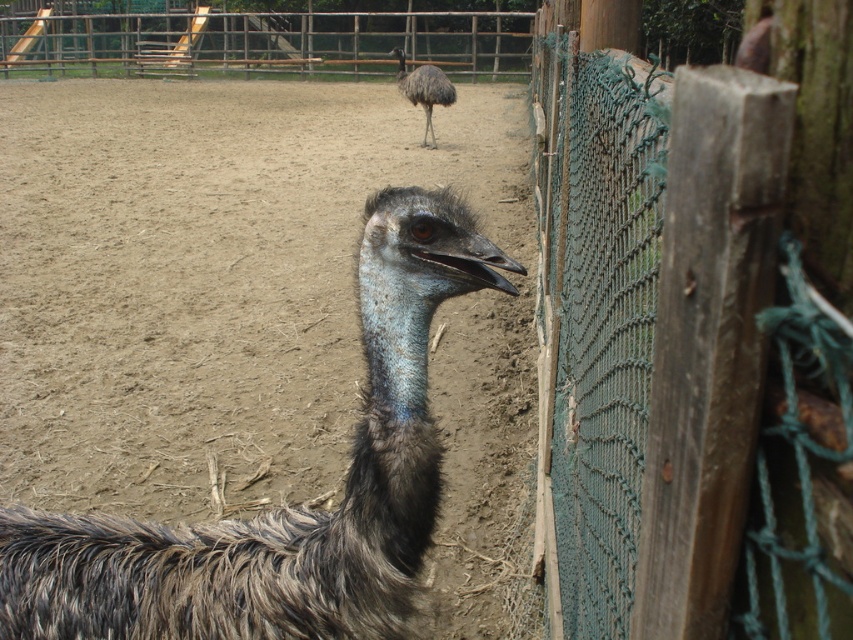
Can you confirm if green mesh fence at right is bigger than dark brown feathers at upper center?

Correct, green mesh fence at right is larger in size than dark brown feathers at upper center.

Between point (759, 348) and point (419, 97), which one is positioned behind?

The point (419, 97) is more distant.

Does point (764, 180) lie behind point (413, 77)?

No, it is not.

Locate an element on the screen. green mesh fence at right is located at coordinates (695, 336).

Who is lower down, dark brown feathered ostrich at center or dark brown feathers at upper center?

dark brown feathered ostrich at center is lower down.

Which is behind, point (376, 280) or point (399, 65)?

The point (399, 65) is more distant.

Is point (322, 547) less distant than point (432, 129)?

Yes, point (322, 547) is in front of point (432, 129).

Locate an element on the screen. The width and height of the screenshot is (853, 640). dark brown feathered ostrich at center is located at coordinates (283, 506).

Between green mesh fence at right and dark brown feathered ostrich at center, which one has more height?

green mesh fence at right

Between point (706, 84) and point (369, 592), which one is positioned in front?

Point (706, 84) is more forward.

Who is more forward, (698, 538) or (271, 602)?

Positioned in front is point (698, 538).

Find the location of a particular element. The height and width of the screenshot is (640, 853). green mesh fence at right is located at coordinates click(x=695, y=336).